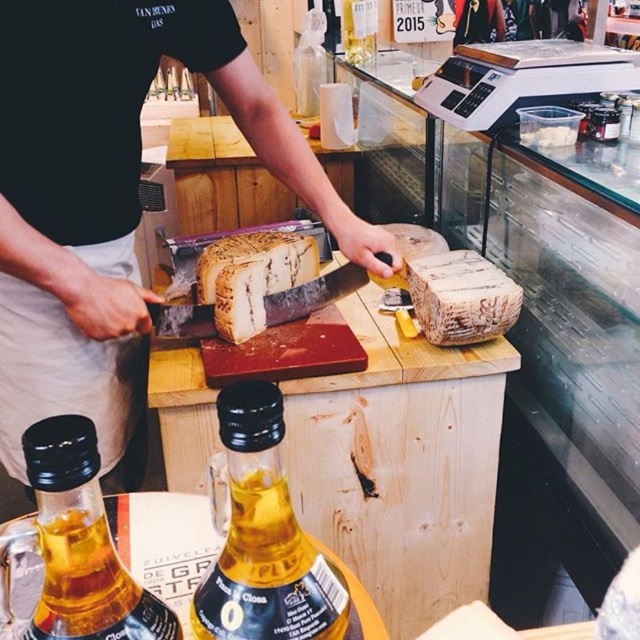
Which of these two, black matte bread at center or translucent glass bottle at center, stands taller?

With more height is black matte bread at center.

Can you confirm if black matte bread at center is thinner than translucent glass bottle at center?

In fact, black matte bread at center might be wider than translucent glass bottle at center.

Where is `black matte bread at center`? black matte bread at center is located at coordinates (112, 202).

At what (x,y) coordinates should I click in order to perform the action: click on black matte bread at center. Please return your answer as a coordinate pair (x, y). Looking at the image, I should click on (112, 202).

Is black matte bread at center behind white crumbly bread at center?

No, it is not.

Can you confirm if black matte bread at center is thinner than white crumbly bread at center?

In fact, black matte bread at center might be wider than white crumbly bread at center.

Locate an element on the screen. This screenshot has width=640, height=640. black matte bread at center is located at coordinates (112, 202).

This screenshot has width=640, height=640. Find the location of `black matte bread at center`. black matte bread at center is located at coordinates (112, 202).

Between black matte bread at center and white crumbly cheese at center, which one is positioned lower?

black matte bread at center

Can you confirm if black matte bread at center is positioned above white crumbly cheese at center?

No, black matte bread at center is not above white crumbly cheese at center.

At what (x,y) coordinates should I click in order to perform the action: click on black matte bread at center. Please return your answer as a coordinate pair (x, y). The image size is (640, 640). Looking at the image, I should click on (112, 202).